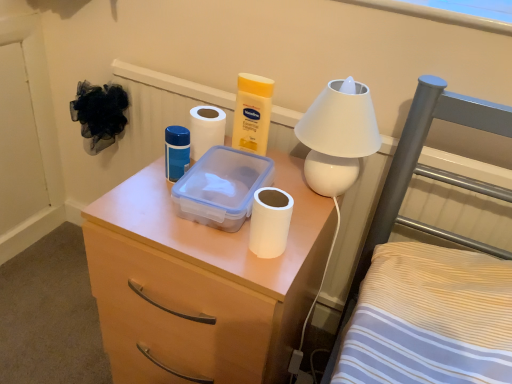
Describe the element at coordinates (221, 188) in the screenshot. The width and height of the screenshot is (512, 384). I see `transparent plastic storage box at center` at that location.

What do you see at coordinates (176, 152) in the screenshot? I see `blue matte container at center` at bounding box center [176, 152].

The height and width of the screenshot is (384, 512). Identify the location of white matte plastic at center. (201, 284).

What do you see at coordinates (338, 136) in the screenshot?
I see `white glossy lamp at upper right` at bounding box center [338, 136].

Measure the distance between point (356, 85) and camera.

Point (356, 85) and camera are 30.83 inches apart.

Identify the location of white matte toilet paper at center, which ranks as the 1th toilet paper in bottom-to-top order. The height and width of the screenshot is (384, 512). (270, 222).

Is transparent plastic storage box at center to the left of white matte toilet paper at center, which is the 1th toilet paper in top-to-bottom order, from the viewer's perspective?

No.

Between transparent plastic storage box at center and white matte toilet paper at center, acting as the 2th toilet paper starting from the right, which one is positioned behind?

white matte toilet paper at center, acting as the 2th toilet paper starting from the right, is further away from the camera.

Locate an element on the screen. storage box beneath the white matte toilet paper at center, which appears as the 2th toilet paper when viewed from the front (from a real-world perspective) is located at coordinates (221, 188).

From the image's perspective, is transparent plastic storage box at center located above white matte toilet paper at center, which is the first toilet paper from left to right?

No.

Between white matte toilet paper at center, the second toilet paper ordered from the bottom, and white matte toilet paper at center, the 2th toilet paper from the back, which one has less height?

With less height is white matte toilet paper at center, the 2th toilet paper from the back.

From a real-world perspective, does white matte toilet paper at center, the second toilet paper ordered from the bottom, stand above white matte toilet paper at center, which appears as the first toilet paper when viewed from the right?

Indeed, from a real-world perspective, white matte toilet paper at center, the second toilet paper ordered from the bottom, stands above white matte toilet paper at center, which appears as the first toilet paper when viewed from the right.

Considering the positions of points (219, 144) and (257, 208), is point (219, 144) closer to camera compared to point (257, 208)?

That is False.

Based on their sizes in the image, would you say white matte toilet paper at center, which appears as the 2th toilet paper when viewed from the front, is bigger or smaller than white matte toilet paper at center, which is the 1th toilet paper in front-to-back order?

Clearly, white matte toilet paper at center, which appears as the 2th toilet paper when viewed from the front, is larger in size than white matte toilet paper at center, which is the 1th toilet paper in front-to-back order.

Is transparent plastic storage box at center touching white matte plastic at center?

There is a gap between transparent plastic storage box at center and white matte plastic at center.

From the image's perspective, which object appears higher, transparent plastic storage box at center or white matte plastic at center?

transparent plastic storage box at center, from the image's perspective.

Considering the points (238, 162) and (272, 276), which point is behind, point (238, 162) or point (272, 276)?

Point (238, 162)

Is transparent plastic storage box at center to the left of white matte plastic at center from the viewer's perspective?

No, transparent plastic storage box at center is not to the left of white matte plastic at center.

Which is in front, point (187, 135) or point (338, 115)?

The point (338, 115) is closer.

Looking at the image, does blue matte container at center seem bigger or smaller compared to white glossy lamp at upper right?

Clearly, blue matte container at center is smaller in size than white glossy lamp at upper right.

Could you tell me if blue matte container at center is facing white glossy lamp at upper right?

No, blue matte container at center is not facing towards white glossy lamp at upper right.

From the image's perspective, is white matte plastic at center below white matte toilet paper at center, arranged as the 1th toilet paper when viewed from the back?

Yes, from the image's perspective, white matte plastic at center is below white matte toilet paper at center, arranged as the 1th toilet paper when viewed from the back.

Considering the sizes of objects white matte plastic at center and white matte toilet paper at center, which appears as the 2th toilet paper when viewed from the front, in the image provided, who is shorter, white matte plastic at center or white matte toilet paper at center, which appears as the 2th toilet paper when viewed from the front,?

Standing shorter between the two is white matte toilet paper at center, which appears as the 2th toilet paper when viewed from the front.

Which is less distant, (x=131, y=208) or (x=196, y=118)?

Point (x=131, y=208) is positioned closer to the camera compared to point (x=196, y=118).

Do you think white matte plastic at center is within white matte toilet paper at center, which appears as the 2th toilet paper when viewed from the front, or outside of it?

white matte plastic at center is outside white matte toilet paper at center, which appears as the 2th toilet paper when viewed from the front.

Considering the sizes of objects blue matte container at center and transparent plastic storage box at center in the image provided, who is shorter, blue matte container at center or transparent plastic storage box at center?

transparent plastic storage box at center is shorter.

Which is in front, point (186, 128) or point (254, 174)?

The point (254, 174) is in front.

Is blue matte container at center located outside transparent plastic storage box at center?

blue matte container at center is positioned outside transparent plastic storage box at center.

Can you confirm if blue matte container at center is positioned to the right of transparent plastic storage box at center?

Incorrect, blue matte container at center is not on the right side of transparent plastic storage box at center.

Consider the image. Considering the sizes of objects white glossy lamp at upper right and white matte plastic at center in the image provided, who is smaller, white glossy lamp at upper right or white matte plastic at center?

white glossy lamp at upper right is smaller.

Is white glossy lamp at upper right facing away from white matte plastic at center?

No.

Is white glossy lamp at upper right not within white matte plastic at center?

A: Absolutely, white glossy lamp at upper right is external to white matte plastic at center.

What are the coordinates of `the 2nd toilet paper directly above the transparent plastic storage box at center (from a real-world perspective)` in the screenshot? It's located at (205, 130).

Identify the location of toilet paper below the white matte toilet paper at center, acting as the 2th toilet paper starting from the right (from a real-world perspective). Image resolution: width=512 pixels, height=384 pixels. (270, 222).

Considering their positions, is blue matte container at center positioned further to white matte toilet paper at center, which is the 1th toilet paper in front-to-back order, than white matte plastic at center?

The object further to white matte toilet paper at center, which is the 1th toilet paper in front-to-back order, is blue matte container at center.

Estimate the real-world distances between objects in this image. Which object is closer to white matte toilet paper at center, the 2th toilet paper from the back, white matte toilet paper at center, the second toilet paper ordered from the bottom, or blue matte container at center?

blue matte container at center is positioned closer to the anchor white matte toilet paper at center, the 2th toilet paper from the back.

From the image, which object appears to be farther from white matte toilet paper at center, which is the 1th toilet paper in front-to-back order, white matte plastic at center or white glossy lamp at upper right?

white matte plastic at center lies further to white matte toilet paper at center, which is the 1th toilet paper in front-to-back order, than the other object.

From the image, which object appears to be nearer to white matte toilet paper at center, acting as the 2th toilet paper starting from the right, transparent plastic storage box at center or blue matte container at center?

Based on the image, blue matte container at center appears to be nearer to white matte toilet paper at center, acting as the 2th toilet paper starting from the right.

Looking at the image, which one is located further to white matte toilet paper at center, which appears as the 2th toilet paper when viewed from the front, white matte plastic at center or white glossy lamp at upper right?

white matte plastic at center is further to white matte toilet paper at center, which appears as the 2th toilet paper when viewed from the front.

From the picture: Estimate the real-world distances between objects in this image. Which object is closer to white matte toilet paper at center, arranged as the 1th toilet paper when viewed from the back, white glossy lamp at upper right or blue matte container at center?

Based on the image, blue matte container at center appears to be nearer to white matte toilet paper at center, arranged as the 1th toilet paper when viewed from the back.

When comparing their distances from white matte toilet paper at center, the 2th toilet paper positioned from the left, does white matte toilet paper at center, the second toilet paper ordered from the bottom, or white glossy lamp at upper right seem closer?

The object closer to white matte toilet paper at center, the 2th toilet paper positioned from the left, is white glossy lamp at upper right.

Looking at this image, estimate the real-world distances between objects in this image. Which object is further from blue matte container at center, transparent plastic storage box at center or white matte toilet paper at center, the 2th toilet paper from the back?

The object further to blue matte container at center is white matte toilet paper at center, the 2th toilet paper from the back.

Identify the location of toilet paper between white matte toilet paper at center, acting as the 2th toilet paper starting from the right, and white glossy lamp at upper right from left to right. (270, 222).

Where is `storage box located between blue matte container at center and white glossy lamp at upper right in the left-right direction`? storage box located between blue matte container at center and white glossy lamp at upper right in the left-right direction is located at coordinates (221, 188).

This screenshot has height=384, width=512. What are the coordinates of `toilet paper that lies between white glossy lamp at upper right and white matte plastic at center from top to bottom` in the screenshot? It's located at (270, 222).

Find the location of a particular element. The image size is (512, 384). toiletry between white matte toilet paper at center, arranged as the 1th toilet paper when viewed from the back, and white matte plastic at center, in the vertical direction is located at coordinates (176, 152).